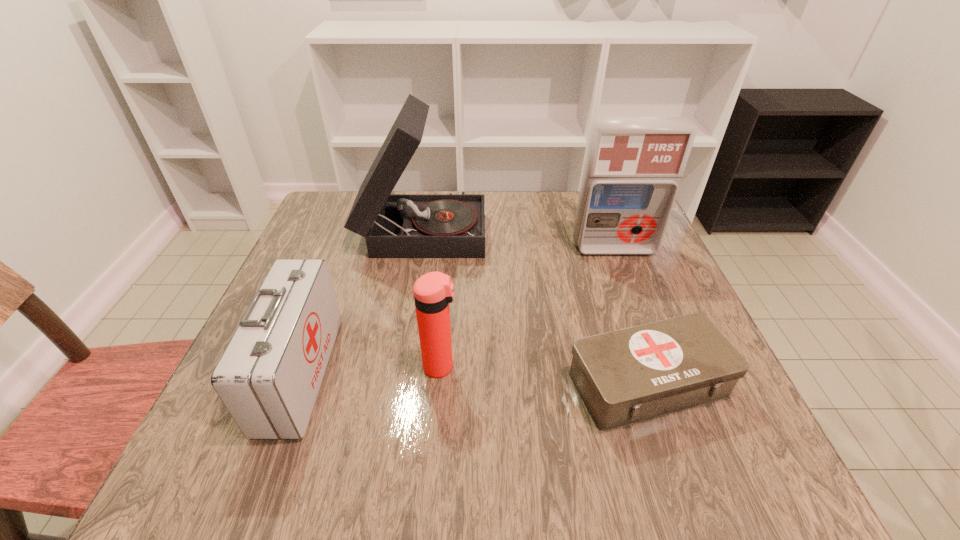
Image resolution: width=960 pixels, height=540 pixels. I want to click on phonograph_record, so click(450, 225).

I want to click on the farthest first-aid kit, so click(x=633, y=166).

Locate an element on the screen. the third shortest object is located at coordinates (433, 291).

Locate an element on the screen. the leftmost first-aid kit is located at coordinates (268, 378).

Image resolution: width=960 pixels, height=540 pixels. I want to click on the second shortest object, so click(268, 378).

What are the coordinates of `the shortest object` in the screenshot? It's located at (626, 376).

This screenshot has width=960, height=540. What are the coordinates of `vacant space positioned on the front-facing side of the phonograph_record` in the screenshot? It's located at (593, 229).

Where is `free location located on the front-facing side of the farthest first-aid kit`? The width and height of the screenshot is (960, 540). free location located on the front-facing side of the farthest first-aid kit is located at coordinates (640, 319).

Locate an element on the screen. vacant space located on the front of the thermos bottle is located at coordinates (435, 439).

The width and height of the screenshot is (960, 540). Identify the location of vacant space situated 0.070m on the front-facing side of the leftmost first-aid kit. (363, 373).